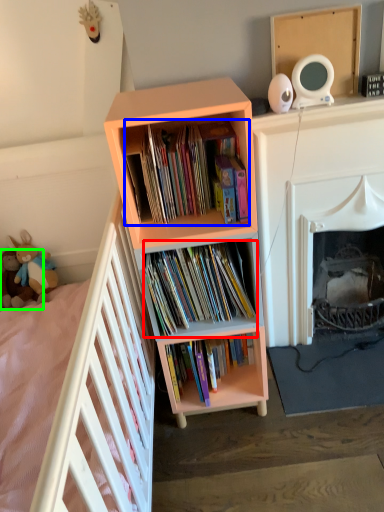
Question: Which is nearer to the book (highlighted by a red box)? book (highlighted by a blue box) or toy (highlighted by a green box).

Choices:
 (A) book
 (B) toy

Answer: (A)